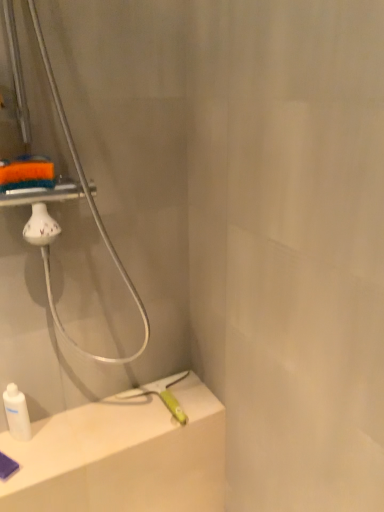
The width and height of the screenshot is (384, 512). What do you see at coordinates (122, 456) in the screenshot?
I see `white matte counter top at lower left` at bounding box center [122, 456].

This screenshot has height=512, width=384. Identify the location of white matte counter top at lower left. (122, 456).

In the scene shown: Measure the distance between white glossy bottle at lower left and camera.

A distance of 1.20 meters exists between white glossy bottle at lower left and camera.

The height and width of the screenshot is (512, 384). Describe the element at coordinates (17, 413) in the screenshot. I see `white glossy bottle at lower left` at that location.

I want to click on white glossy bottle at lower left, so click(x=17, y=413).

What is the approximate width of white glossy bottle at lower left?

The width of white glossy bottle at lower left is 1.89 inches.

This screenshot has width=384, height=512. Identify the location of white matte counter top at lower left. (122, 456).

In the image, is white matte counter top at lower left on the left side or the right side of white glossy bottle at lower left?

In the image, white matte counter top at lower left appears on the right side of white glossy bottle at lower left.

Which object is closer to the camera, white matte counter top at lower left or white glossy bottle at lower left?

white matte counter top at lower left.

Does point (204, 504) appear closer or farther from the camera than point (21, 407)?

Point (204, 504) is positioned farther from the camera compared to point (21, 407).

From the image's perspective, which one is positioned higher, white matte counter top at lower left or white glossy bottle at lower left?

white glossy bottle at lower left.

From a real-world perspective, is white matte counter top at lower left under white glossy bottle at lower left?

Yes, from a real-world perspective, white matte counter top at lower left is below white glossy bottle at lower left.

Which of these two, white matte counter top at lower left or white glossy bottle at lower left, is thinner?

white glossy bottle at lower left.

Who is taller, white matte counter top at lower left or white glossy bottle at lower left?

white glossy bottle at lower left is taller.

Looking at this image, which of these two, white matte counter top at lower left or white glossy bottle at lower left, is bigger?

white matte counter top at lower left is bigger.

Is white matte counter top at lower left completely or partially outside of white glossy bottle at lower left?

white matte counter top at lower left is positioned outside white glossy bottle at lower left.

Is there a large distance between white matte counter top at lower left and white glossy bottle at lower left?

white matte counter top at lower left is actually quite close to white glossy bottle at lower left.

From the picture: Is white matte counter top at lower left facing away from white glossy bottle at lower left?

No, white matte counter top at lower left's orientation is not away from white glossy bottle at lower left.

Looking at this image, how different are the orientations of white matte counter top at lower left and white glossy bottle at lower left in degrees?

The facing directions of white matte counter top at lower left and white glossy bottle at lower left are 32.4 degrees apart.

How much distance is there between white matte counter top at lower left and white glossy bottle at lower left?

white matte counter top at lower left and white glossy bottle at lower left are 11.76 inches apart from each other.

Identify the location of counter top that appears in front of the white glossy bottle at lower left. This screenshot has width=384, height=512. (122, 456).

Does white glossy bottle at lower left appear on the left side of white matte counter top at lower left?

Correct, you'll find white glossy bottle at lower left to the left of white matte counter top at lower left.

In the image, is white glossy bottle at lower left positioned in front of or behind white matte counter top at lower left?

white glossy bottle at lower left is behind white matte counter top at lower left.

Considering the positions of points (23, 424) and (138, 437), is point (23, 424) farther from camera compared to point (138, 437)?

That is True.

From the image's perspective, is white glossy bottle at lower left over white matte counter top at lower left?

Yes.

From a real-world perspective, relative to white matte counter top at lower left, is white glossy bottle at lower left vertically above or below?

white glossy bottle at lower left is situated higher than white matte counter top at lower left in the real world.

Is white glossy bottle at lower left wider than white matte counter top at lower left?

In fact, white glossy bottle at lower left might be narrower than white matte counter top at lower left.

Considering the relative sizes of white glossy bottle at lower left and white matte counter top at lower left in the image provided, is white glossy bottle at lower left taller than white matte counter top at lower left?

Yes.

In terms of size, does white glossy bottle at lower left appear bigger or smaller than white matte counter top at lower left?

In the image, white glossy bottle at lower left appears to be smaller than white matte counter top at lower left.

Would you say white matte counter top at lower left is part of white glossy bottle at lower left's contents?

No, white matte counter top at lower left is not surrounded by white glossy bottle at lower left.

Are white glossy bottle at lower left and white matte counter top at lower left located far from each other?

No, white glossy bottle at lower left is not far from white matte counter top at lower left.

Is white glossy bottle at lower left turned away from white matte counter top at lower left?

white glossy bottle at lower left is not turned away from white matte counter top at lower left.

Measure the distance between white glossy bottle at lower left and white matte counter top at lower left.

11.76 inches.

This screenshot has height=512, width=384. I want to click on bottle above the white matte counter top at lower left (from the image's perspective), so click(17, 413).

This screenshot has height=512, width=384. Find the location of `bottle above the white matte counter top at lower left (from the image's perspective)`. bottle above the white matte counter top at lower left (from the image's perspective) is located at coordinates (17, 413).

Image resolution: width=384 pixels, height=512 pixels. In order to click on counter top located in front of the white glossy bottle at lower left in this screenshot , I will do `click(122, 456)`.